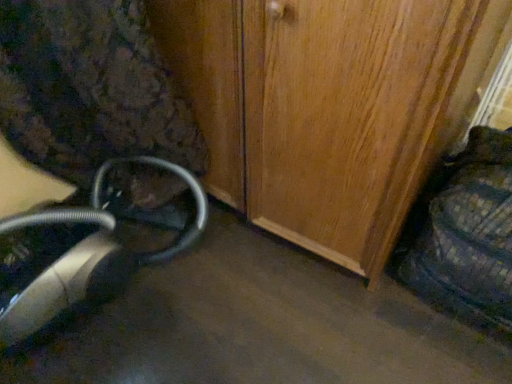
This screenshot has height=384, width=512. In order to click on empty space that is to the right of metallic silver vacuum cleaner at lower left in this screenshot , I will do `click(258, 304)`.